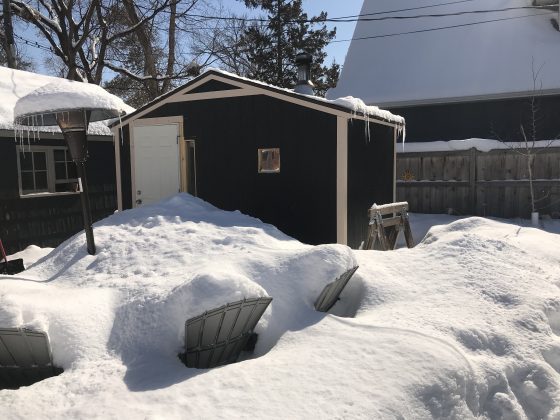
Where is `2 windows on left`? 2 windows on left is located at coordinates click(x=30, y=185), click(x=69, y=174).